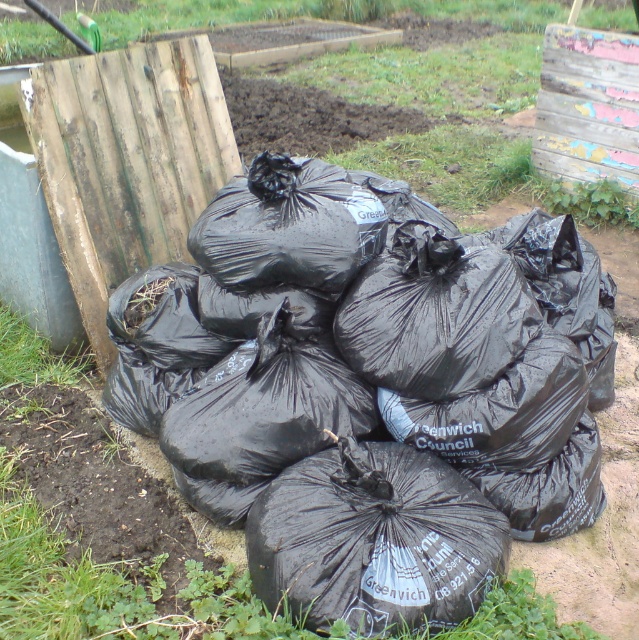
Question: Does black plastic bags at center have a smaller size compared to black plastic sack at center?

Choices:
 (A) no
 (B) yes

Answer: (A)

Question: Which of these objects is positioned closest to the black plastic bags at center?

Choices:
 (A) black plastic sack at center
 (B) green grass at upper center

Answer: (A)

Question: Which object is farther from the camera taking this photo?

Choices:
 (A) green grass at upper center
 (B) black plastic bags at center
 (C) black plastic sack at center

Answer: (A)

Question: Is black plastic sack at center to the right of green grass at upper center from the viewer's perspective?

Choices:
 (A) no
 (B) yes

Answer: (B)

Question: Is black plastic bags at center thinner than green grass at upper center?

Choices:
 (A) no
 (B) yes

Answer: (B)

Question: Which point is closer to the camera?

Choices:
 (A) (479, 284)
 (B) (348, 513)

Answer: (B)